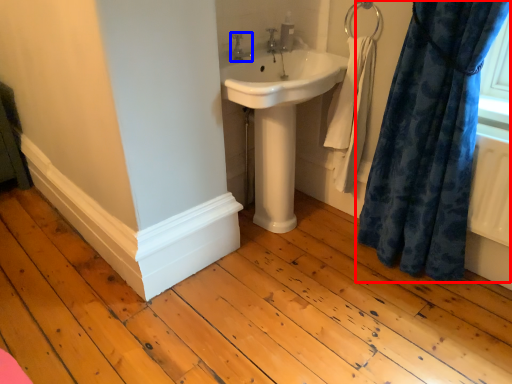
Question: Which object is closer to the camera taking this photo, curtain (highlighted by a red box) or tap (highlighted by a blue box)?

Choices:
 (A) curtain
 (B) tap

Answer: (A)